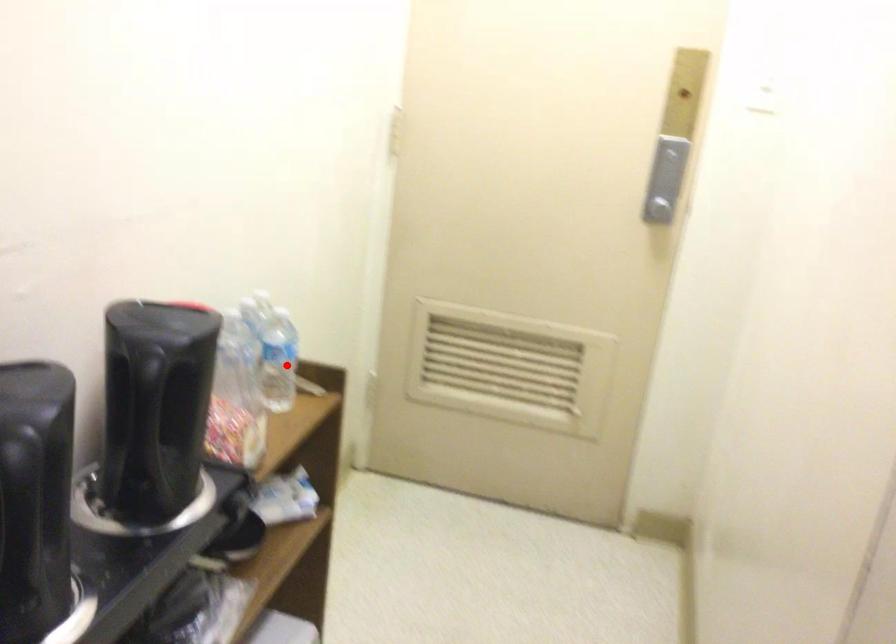
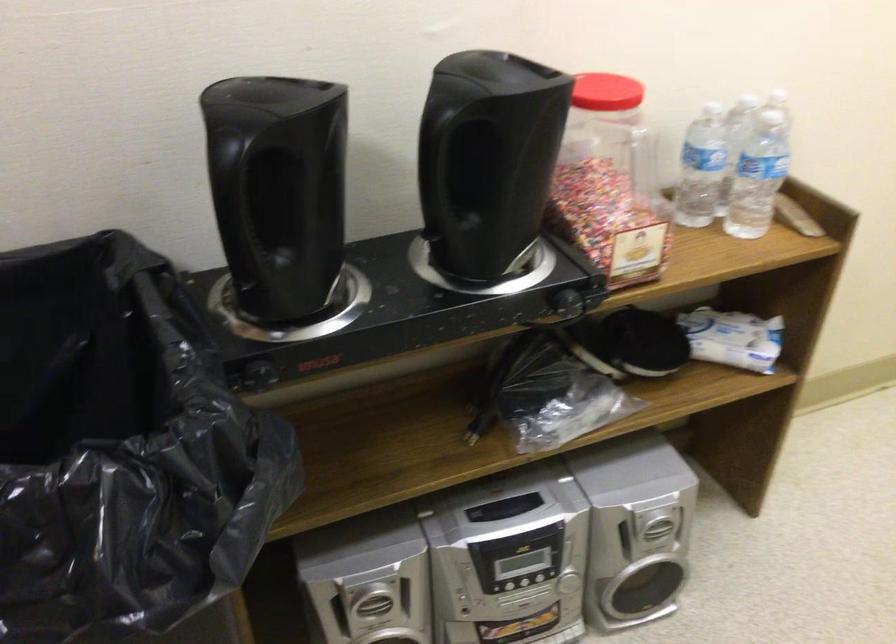
The point at the highlighted location is marked in the first image. Where is the corresponding point in the second image?

(757, 176)